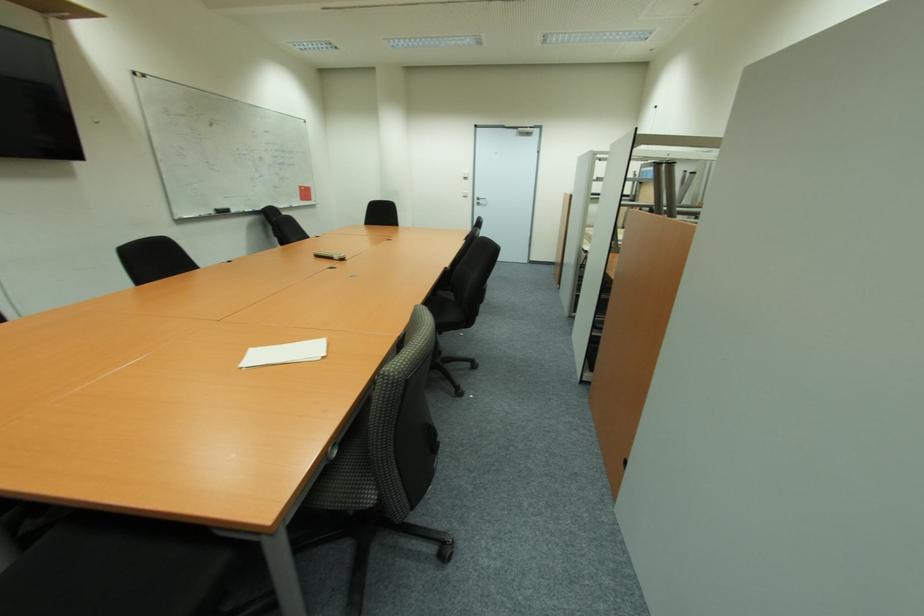
This screenshot has width=924, height=616. Describe the element at coordinates (480, 200) in the screenshot. I see `the silver door handle` at that location.